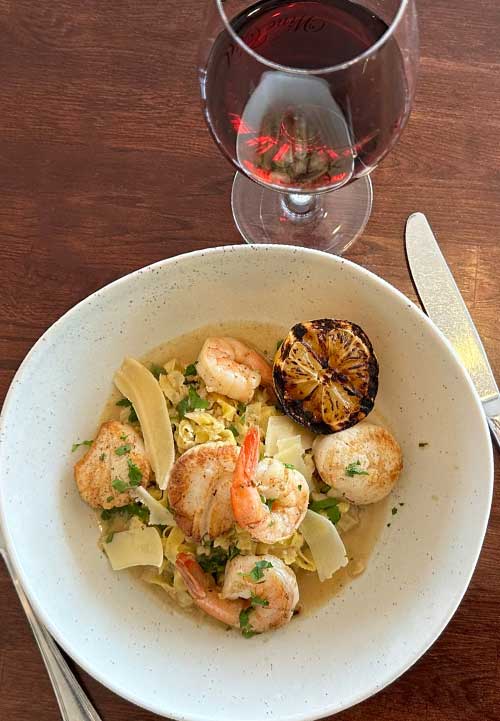
You are a GUI agent. You are given a task and a screenshot of the screen. Output one action in this format:
    pyautogui.click(x=<x>, y=<y>)
    Task: Click on the whine glass
    This screenshot has width=500, height=721.
    Given the screenshot: What is the action you would take?
    pyautogui.click(x=318, y=225)